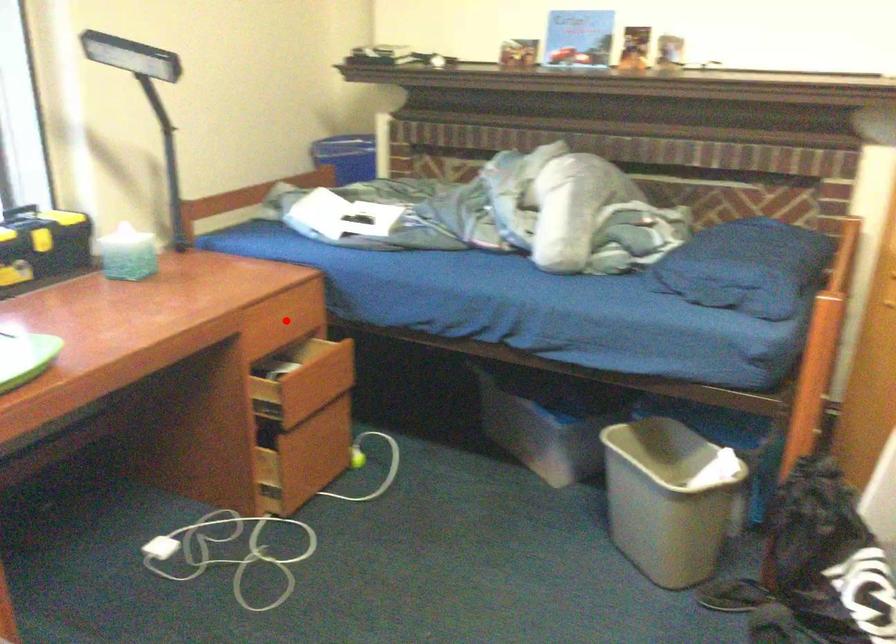
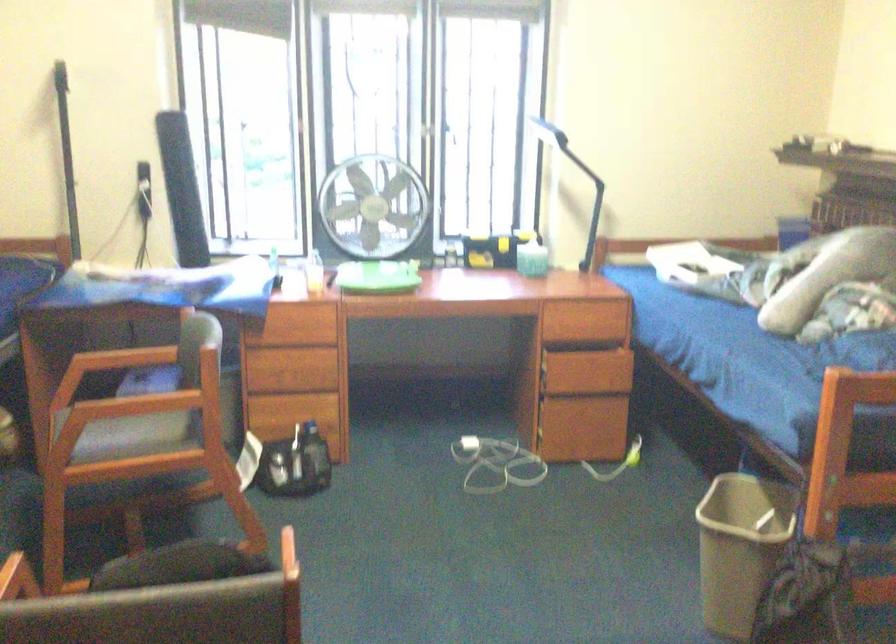
Find the pixel in the second image that matches the highlighted location in the first image.

(596, 319)